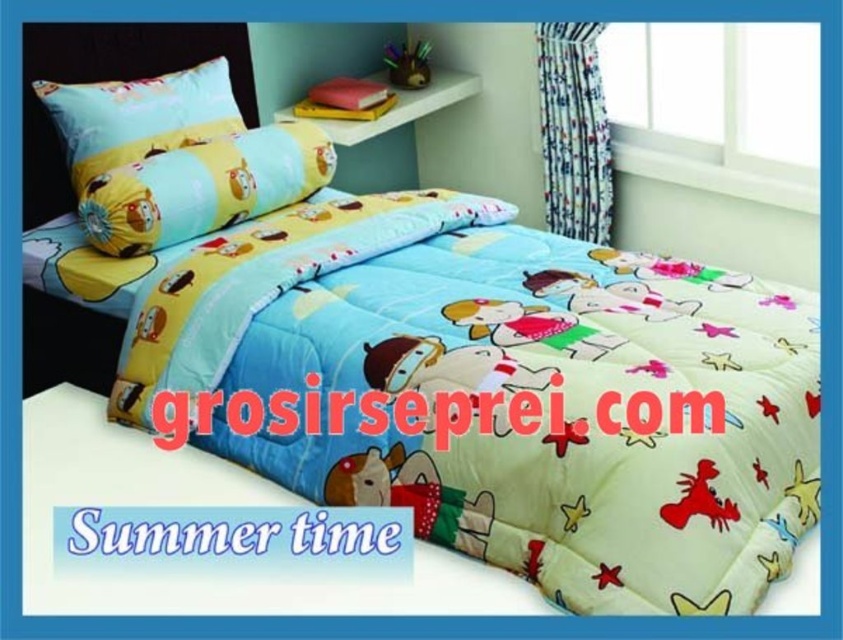
You are looking at the two pillows on the bed. Which one is nearer to you, the yellow fabric pillow at upper left or the light blue fabric pillow at upper left?

The yellow fabric pillow at upper left is closer to the viewer than the light blue fabric pillow at upper left.

You are arranging pillows on a bed and have the yellow fabric pillow at upper left and the light blue fabric pillow at upper left. If you want to place them in order from left to right, which pillow should be placed first?

The light blue fabric pillow at upper left should be placed first since the yellow fabric pillow at upper left is positioned to its right side.